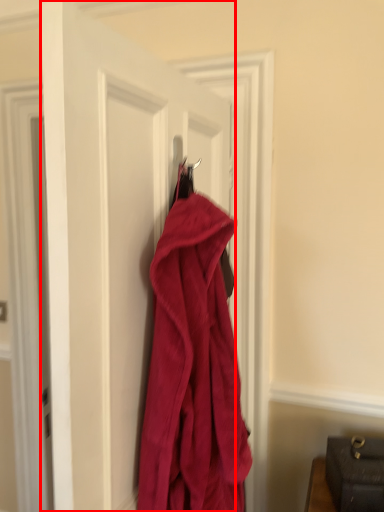
Question: Considering the relative positions of door (annotated by the red box) and towel in the image provided, where is door (annotated by the red box) located with respect to the staircase?

Choices:
 (A) right
 (B) left

Answer: (B)